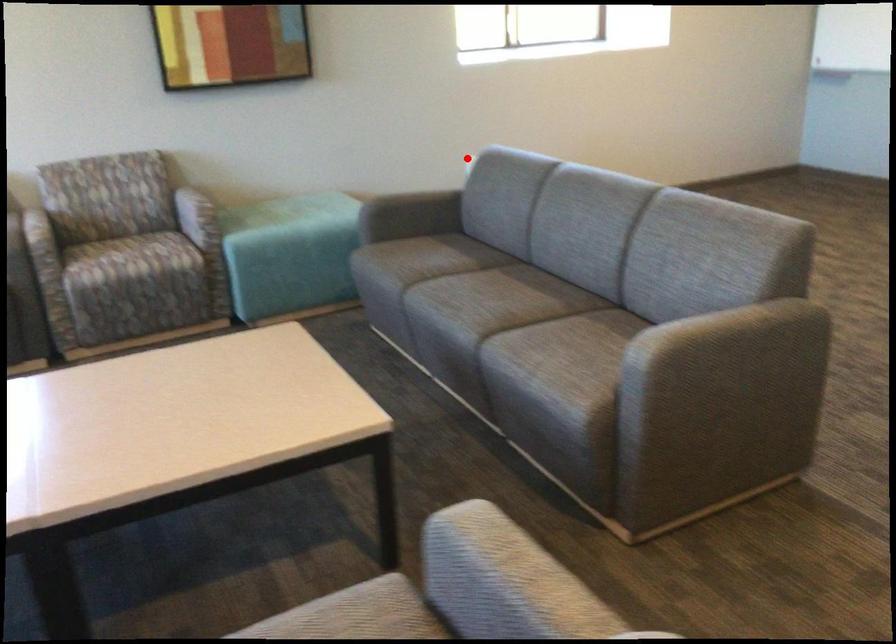
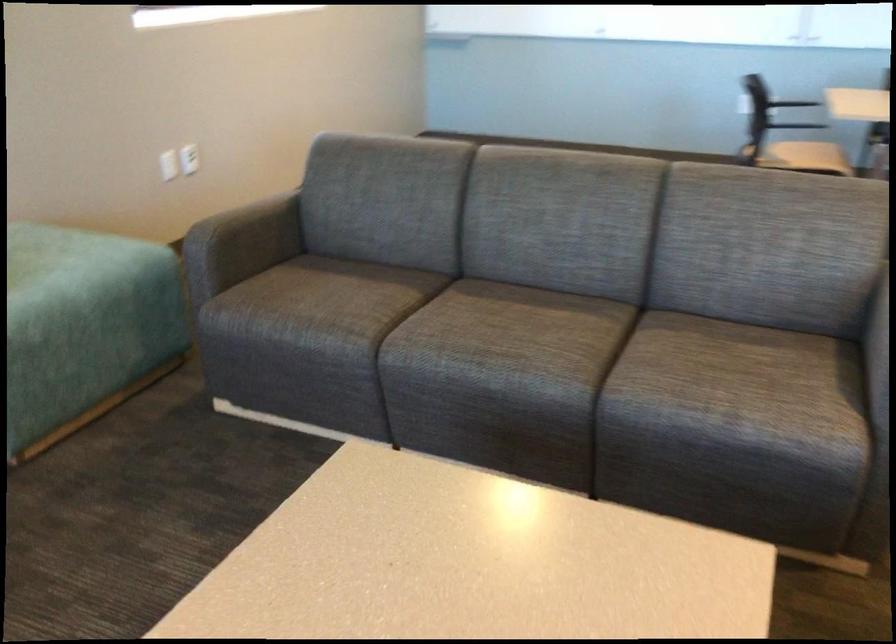
Where in the second image is the point corresponding to the highlighted location from the first image?

(168, 165)